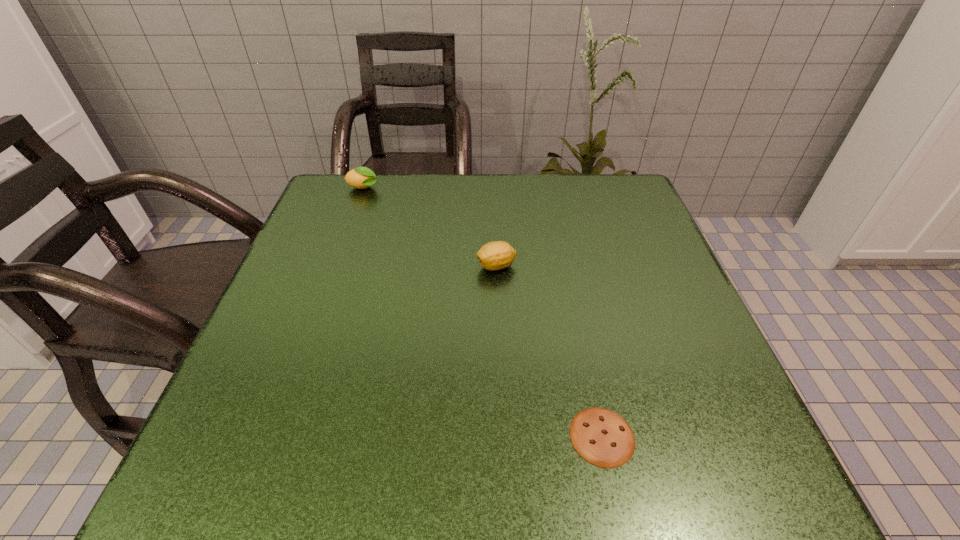
At what (x,y) coordinates should I click in order to perform the action: click on vacant space positioned 0.160m on the left of the shortest object. Please return your answer as a coordinate pair (x, y). The width and height of the screenshot is (960, 540). Looking at the image, I should click on (462, 436).

Locate an element on the screen. The image size is (960, 540). object at the far edge is located at coordinates (362, 177).

Where is `object present at the near edge`? This screenshot has width=960, height=540. object present at the near edge is located at coordinates (602, 437).

The image size is (960, 540). Find the location of `object present at the left edge`. object present at the left edge is located at coordinates (362, 177).

What are the coordinates of `object that is at the far left corner` in the screenshot? It's located at (362, 177).

Locate an element on the screen. The width and height of the screenshot is (960, 540). vacant space at the far edge is located at coordinates (390, 200).

The width and height of the screenshot is (960, 540). I want to click on vacant position at the near edge of the desktop, so (653, 481).

The width and height of the screenshot is (960, 540). I want to click on vacant region at the left edge, so point(291,272).

Locate an element on the screen. The image size is (960, 540). free space at the right edge of the desktop is located at coordinates (610, 279).

Where is `blank space at the far left corner of the desktop`? The height and width of the screenshot is (540, 960). blank space at the far left corner of the desktop is located at coordinates click(x=353, y=209).